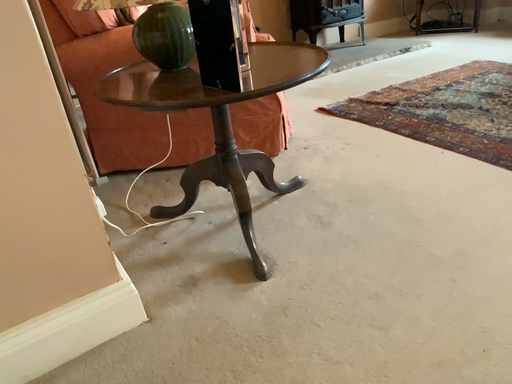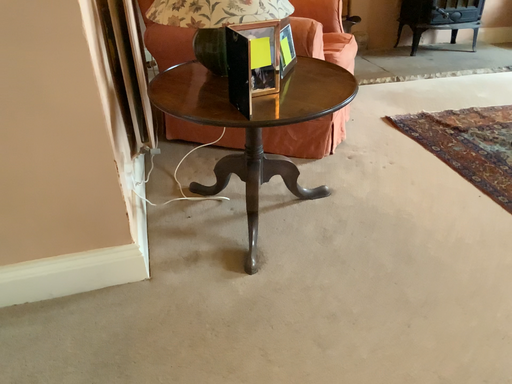
Question: Which way did the camera rotate in the video?

Choices:
 (A) rotated right
 (B) rotated left

Answer: (B)